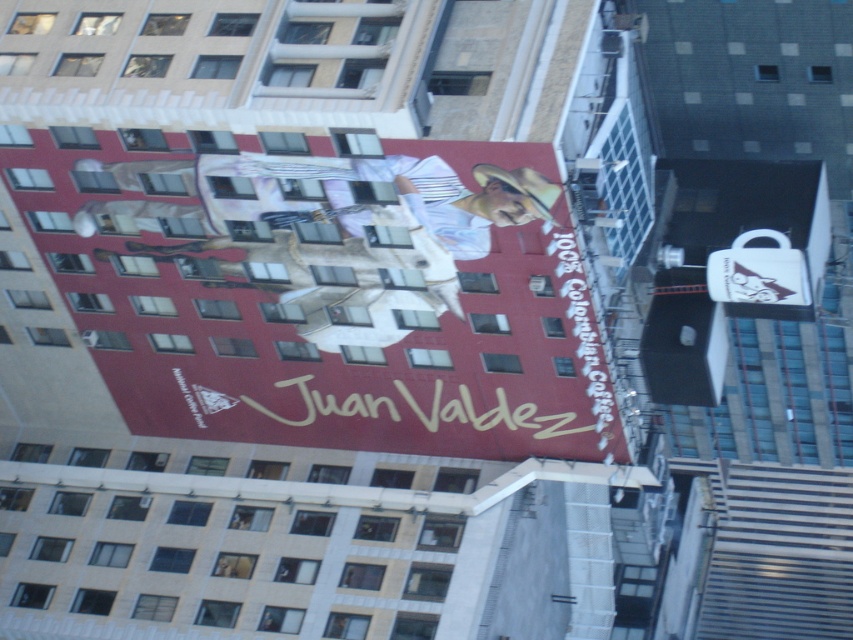
Between point (492, 321) and point (583, 371), which one is positioned behind?

The point (583, 371) is behind.

Does point (270, 224) lie behind point (558, 259)?

Yes.

The height and width of the screenshot is (640, 853). What do you see at coordinates (328, 292) in the screenshot? I see `matte red billboard at upper center` at bounding box center [328, 292].

Image resolution: width=853 pixels, height=640 pixels. In order to click on matte red billboard at upper center in this screenshot , I will do `click(328, 292)`.